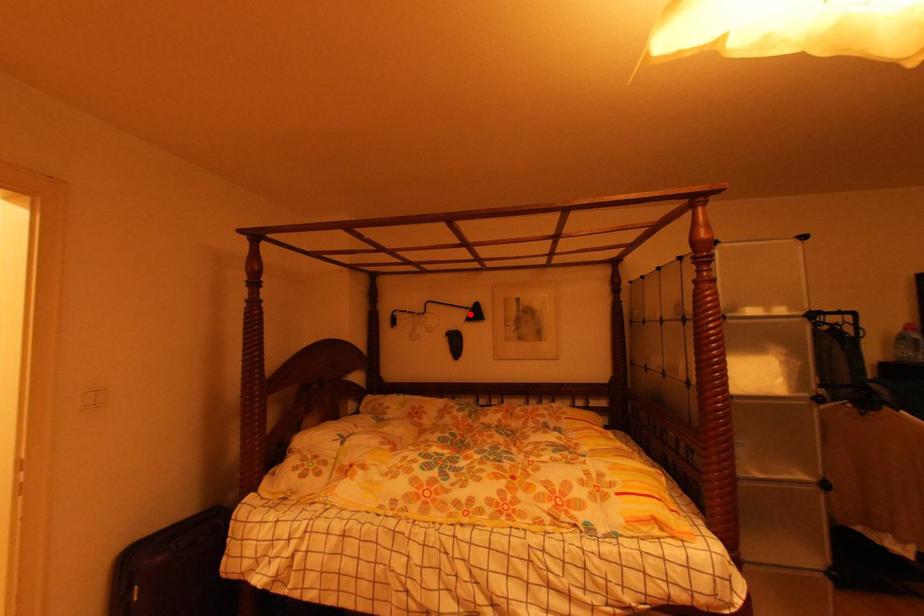
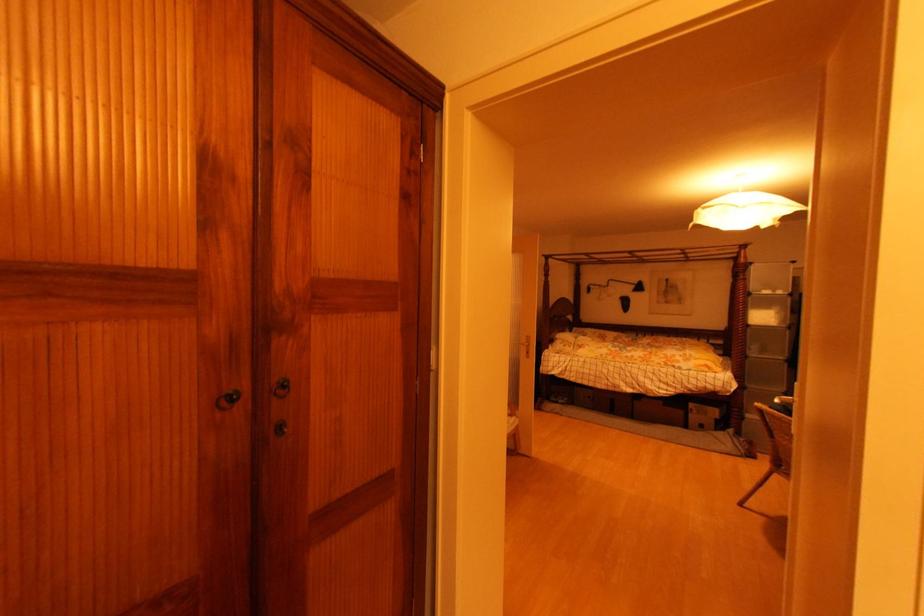
Question: I am providing you with two images of the same scene from different viewpoints. A red point is marked on the first image. At the location where the point appears in image 1, is it still visible in image 2?

Choices:
 (A) Yes
 (B) No

Answer: (A)